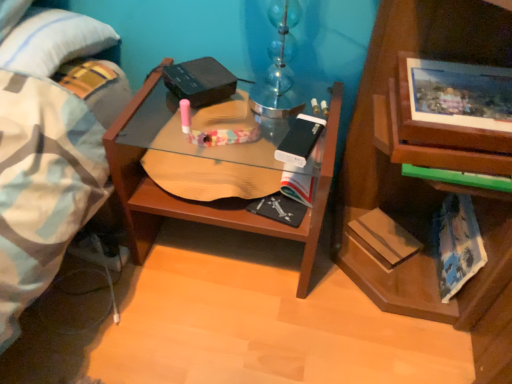
Question: From a real-world perspective, is wooden desk at center physically above hardcover book at lower right, which is the 2th paperback book in right-to-left order?

Choices:
 (A) no
 (B) yes

Answer: (B)

Question: Are wooden desk at center and hardcover book at lower right, which is the 2th paperback book in right-to-left order, beside each other?

Choices:
 (A) yes
 (B) no

Answer: (B)

Question: From a real-world perspective, is wooden desk at center located beneath hardcover book at lower right, the second paperback book in the left-to-right sequence?

Choices:
 (A) no
 (B) yes

Answer: (A)

Question: Does wooden desk at center appear on the right side of hardcover book at lower right, which is the 2th paperback book in right-to-left order?

Choices:
 (A) yes
 (B) no

Answer: (B)

Question: Can you confirm if wooden desk at center is smaller than hardcover book at lower right, which is the 2th paperback book in right-to-left order?

Choices:
 (A) yes
 (B) no

Answer: (B)

Question: Relative to wooden desk at center, is hardcover book at lower right, which is the 2th paperback book in right-to-left order, in front or behind?

Choices:
 (A) behind
 (B) front

Answer: (A)

Question: From their relative heights in the image, would you say hardcover book at lower right, the second paperback book in the left-to-right sequence, is taller or shorter than wooden desk at center?

Choices:
 (A) short
 (B) tall

Answer: (A)

Question: Is point [x=415, y=248] closer or farther from the camera than point [x=323, y=216]?

Choices:
 (A) farther
 (B) closer

Answer: (A)

Question: Looking at their shapes, would you say hardcover book at lower right, which is the 2th paperback book in right-to-left order, is wider or thinner than wooden desk at center?

Choices:
 (A) wide
 (B) thin

Answer: (B)

Question: Considering the positions of point [465, 256] and point [307, 125], is point [465, 256] closer or farther from the camera than point [307, 125]?

Choices:
 (A) closer
 (B) farther

Answer: (B)

Question: From the image's perspective, is blue tie-dye paperback book at lower right, which appears as the third paperback book when viewed from the left, above or below white matte paperback book at center, acting as the 3th paperback book starting from the right?

Choices:
 (A) below
 (B) above

Answer: (A)

Question: Visually, is blue tie-dye paperback book at lower right, which appears as the third paperback book when viewed from the left, positioned to the left or to the right of white matte paperback book at center, acting as the 3th paperback book starting from the right?

Choices:
 (A) right
 (B) left

Answer: (A)

Question: From a real-world perspective, relative to white matte paperback book at center, acting as the 3th paperback book starting from the right, is blue tie-dye paperback book at lower right, which appears as the 1th paperback book when viewed from the right, vertically above or below?

Choices:
 (A) above
 (B) below

Answer: (B)

Question: From the image's perspective, is hardcover book at lower right, which is the 2th paperback book in right-to-left order, above or below blue tie-dye paperback book at lower right, which appears as the 1th paperback book when viewed from the right?

Choices:
 (A) above
 (B) below

Answer: (B)

Question: Is hardcover book at lower right, the second paperback book in the left-to-right sequence, in front of or behind blue tie-dye paperback book at lower right, which appears as the 1th paperback book when viewed from the right, in the image?

Choices:
 (A) behind
 (B) front

Answer: (A)